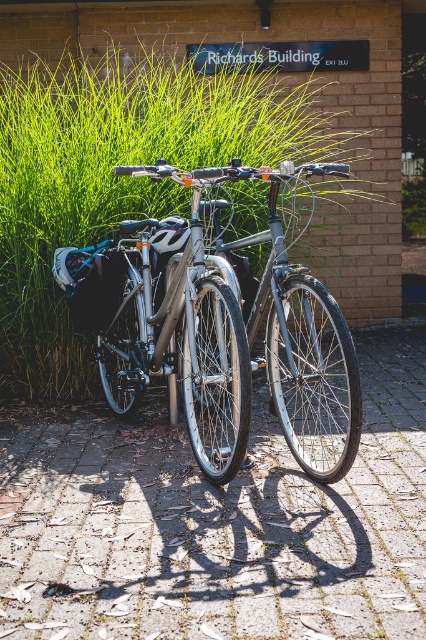
Question: Is brick pavement at center bigger than green grass at center?

Choices:
 (A) yes
 (B) no

Answer: (B)

Question: Which object is positioned farthest from the green grass at center?

Choices:
 (A) brick pavement at center
 (B) shiny metallic bicycle at center

Answer: (A)

Question: Is green grass at center closer to camera compared to shiny metallic bicycle at center?

Choices:
 (A) yes
 (B) no

Answer: (B)

Question: Which point appears closest to the camera in this image?

Choices:
 (A) click(x=298, y=170)
 (B) click(x=103, y=403)
 (C) click(x=227, y=124)

Answer: (A)

Question: Which point is closer to the camera?

Choices:
 (A) green grass at center
 (B) brick pavement at center
 (C) shiny metallic bicycle at center

Answer: (B)

Question: Is brick pavement at center further to the viewer compared to green grass at center?

Choices:
 (A) no
 (B) yes

Answer: (A)